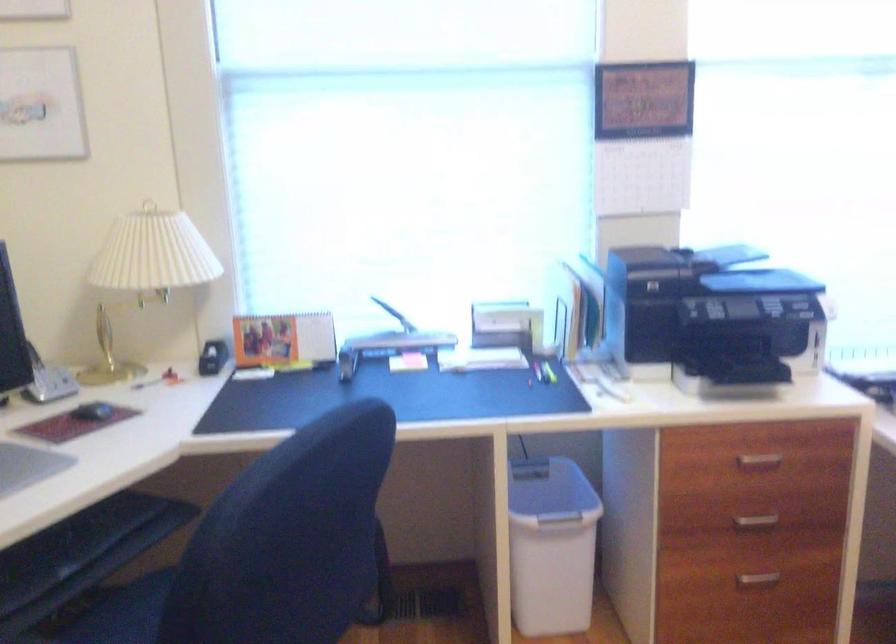
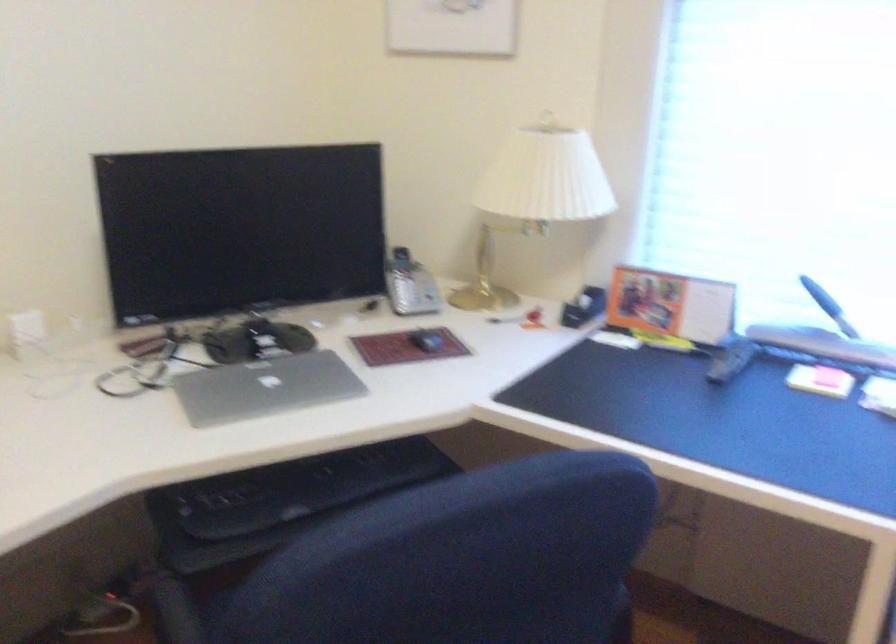
In the second image, find the point that corresponds to pixel 150 383 in the first image.

(504, 319)